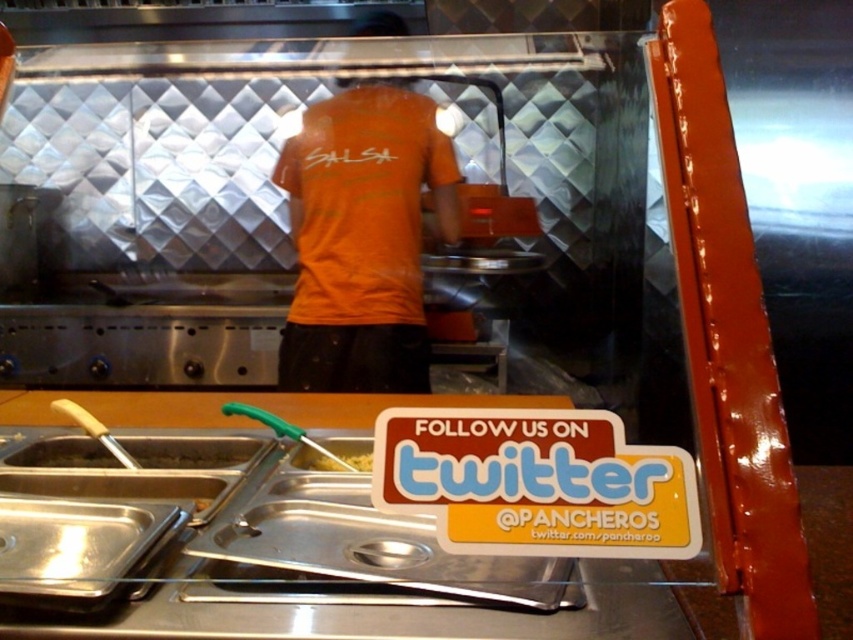
Question: Is white plastic sign at lower center bigger than metallic silver tray at lower left?

Choices:
 (A) no
 (B) yes

Answer: (B)

Question: Which point is farther to the camera?

Choices:
 (A) white plastic sign at lower center
 (B) metallic silver tray at lower left
 (C) yellow matte pasta at center
 (D) orange matte shirt at center

Answer: (D)

Question: Does orange matte shirt at center come behind yellow matte pasta at center?

Choices:
 (A) no
 (B) yes

Answer: (B)

Question: Observing the image, what is the correct spatial positioning of metallic silver tray at lower left in reference to yellow matte pasta at center?

Choices:
 (A) left
 (B) right

Answer: (A)

Question: Which of the following is the farthest from the observer?

Choices:
 (A) (73, 461)
 (B) (442, 147)
 (C) (328, 465)

Answer: (B)

Question: Among these points, which one is nearest to the camera?

Choices:
 (A) (316, 323)
 (B) (47, 454)
 (C) (352, 468)
 (D) (602, 483)

Answer: (D)